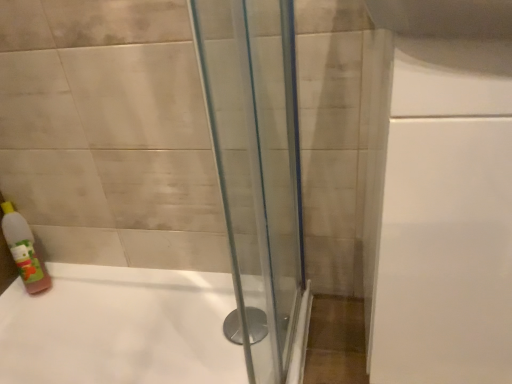
Question: Should I look upward or downward to see translucent plastic bottle at lower left?

Choices:
 (A) down
 (B) up

Answer: (A)

Question: Does white glossy bathtub at center turn towards translucent plastic bottle at lower left?

Choices:
 (A) yes
 (B) no

Answer: (B)

Question: Considering the relative sizes of white glossy bathtub at center and translucent plastic bottle at lower left in the image provided, is white glossy bathtub at center wider than translucent plastic bottle at lower left?

Choices:
 (A) yes
 (B) no

Answer: (A)

Question: Is white glossy bathtub at center positioned with its back to translucent plastic bottle at lower left?

Choices:
 (A) no
 (B) yes

Answer: (B)

Question: From a real-world perspective, is white glossy bathtub at center located higher than translucent plastic bottle at lower left?

Choices:
 (A) no
 (B) yes

Answer: (A)

Question: Is translucent plastic bottle at lower left a part of white glossy bathtub at center?

Choices:
 (A) yes
 (B) no

Answer: (B)

Question: Is white glossy bathtub at center at the left side of translucent plastic bottle at lower left?

Choices:
 (A) no
 (B) yes

Answer: (A)

Question: Is translucent plastic bottle at lower left not close to white glossy bathtub at center?

Choices:
 (A) no
 (B) yes

Answer: (A)

Question: Considering the relative sizes of translucent plastic bottle at lower left and white glossy bathtub at center in the image provided, is translucent plastic bottle at lower left bigger than white glossy bathtub at center?

Choices:
 (A) yes
 (B) no

Answer: (B)

Question: Is translucent plastic bottle at lower left positioned beyond the bounds of white glossy bathtub at center?

Choices:
 (A) yes
 (B) no

Answer: (A)

Question: Is white glossy bathtub at center at the back of translucent plastic bottle at lower left?

Choices:
 (A) no
 (B) yes

Answer: (A)

Question: Does translucent plastic bottle at lower left come in front of white glossy bathtub at center?

Choices:
 (A) no
 (B) yes

Answer: (A)

Question: Can you confirm if translucent plastic bottle at lower left is shorter than white glossy bathtub at center?

Choices:
 (A) yes
 (B) no

Answer: (B)

Question: Does point (79, 296) appear closer or farther from the camera than point (20, 276)?

Choices:
 (A) farther
 (B) closer

Answer: (B)